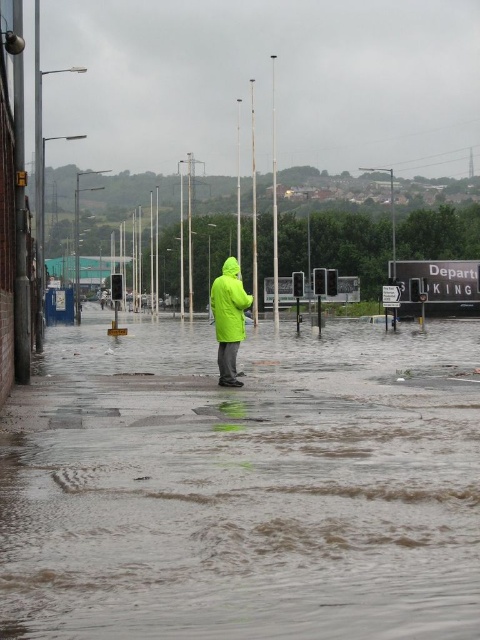
You are a pedestrian trying to cross the flooded street. You see the brown muddy water at center and the bright green waterproof jacket at center. Which object is taller from your perspective?

The bright green waterproof jacket at center is taller than the brown muddy water at center.

You are standing at the edge of the flooded street and want to reach the point marked at coordinates point (160, 625). If your maximum comfortable walking distance is 4 meters, can you safely reach that point without getting too deep into the water?

The distance of point (160, 625) from viewer is 4.17 meters, which exceeds your maximum comfortable walking distance of 4 meters. Therefore, you cannot safely reach that point without getting too deep into the water.

You are a pedestrian trying to cross the flooded street. You see the brown muddy water at center and the bright green waterproof jacket at center. Which object is closer to you?

The brown muddy water at center is closer to the viewer than the bright green waterproof jacket at center, so the brown muddy water at center is closer to you.